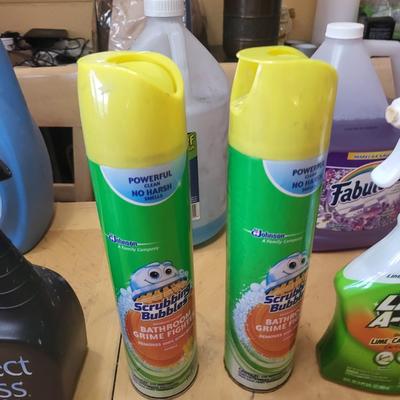
Identify the location of cleaning supplies. The width and height of the screenshot is (400, 400). (371, 290), (343, 142), (272, 211), (174, 204), (215, 173), (36, 183), (34, 318).